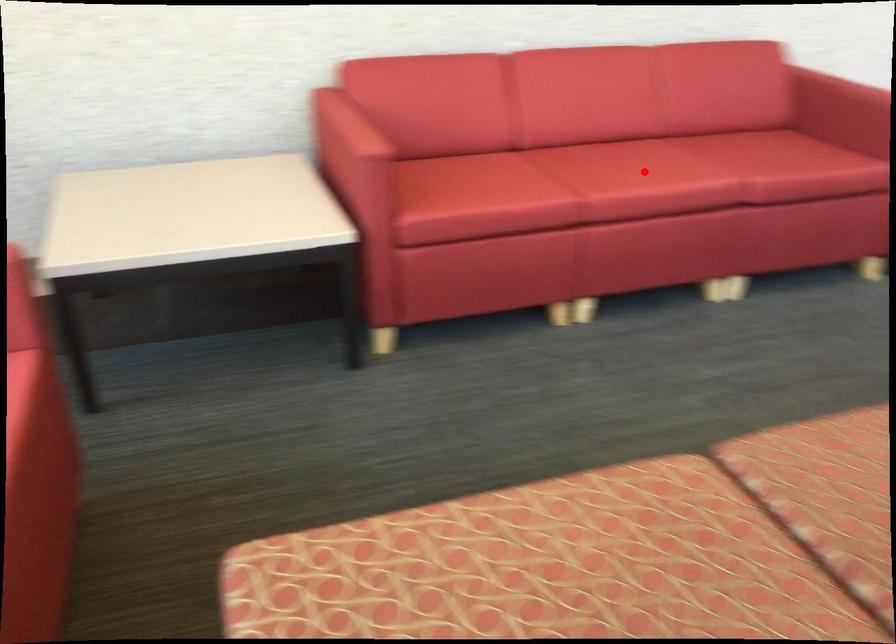
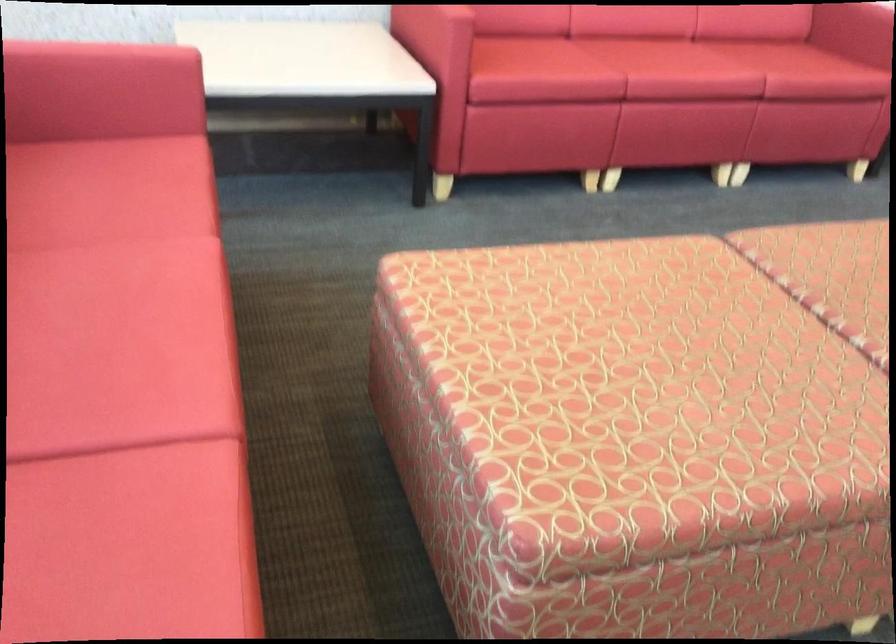
Question: I am providing you with two images of the same scene from different viewpoints. A red point is shown in image1. For the corresponding object point in image2, is it positioned nearer or farther from the camera?

Choices:
 (A) Nearer
 (B) Farther

Answer: (B)